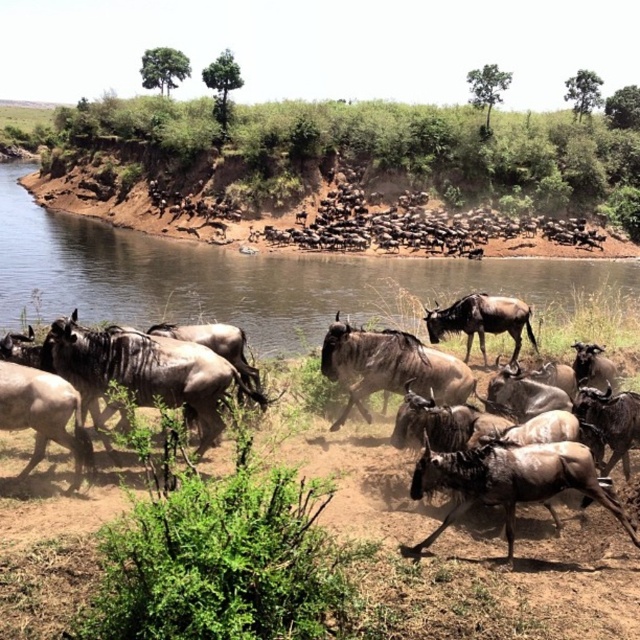
Question: Can you confirm if brown sandy dirt field at center is positioned to the left of brown dirt river at upper center?

Choices:
 (A) yes
 (B) no

Answer: (B)

Question: Among these points, which one is nearest to the camera?

Choices:
 (A) (227, 560)
 (B) (122, 209)

Answer: (A)

Question: In this image, where is brown sandy dirt field at center located relative to brown dirt at upper center?

Choices:
 (A) left
 (B) right

Answer: (B)

Question: Which point is farther to the camera?

Choices:
 (A) brown dirt river at upper center
 (B) brown dirt at upper center

Answer: (B)

Question: Which point is farther to the camera?

Choices:
 (A) brown dirt river at upper center
 (B) brown dirt at upper center

Answer: (B)

Question: Does brown sandy dirt field at center lie in front of brown dirt river at upper center?

Choices:
 (A) no
 (B) yes

Answer: (B)